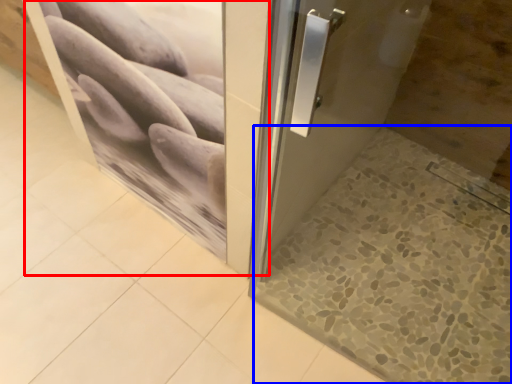
Question: Which object is further to the camera taking this photo, screen door (highlighted by a red box) or tile (highlighted by a blue box)?

Choices:
 (A) screen door
 (B) tile

Answer: (B)